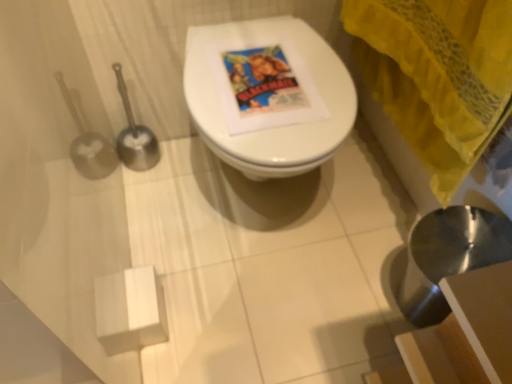
Question: Should I look upward or downward to see metallic silver sink at lower right?

Choices:
 (A) down
 (B) up

Answer: (A)

Question: Does metallic silver sink at lower right have a smaller size compared to yellow fabric curtain at upper right?

Choices:
 (A) no
 (B) yes

Answer: (B)

Question: Is metallic silver sink at lower right not close to yellow fabric curtain at upper right?

Choices:
 (A) yes
 (B) no

Answer: (B)

Question: Considering the relative sizes of metallic silver sink at lower right and yellow fabric curtain at upper right in the image provided, is metallic silver sink at lower right wider than yellow fabric curtain at upper right?

Choices:
 (A) yes
 (B) no

Answer: (A)

Question: Would you say yellow fabric curtain at upper right is part of metallic silver sink at lower right's contents?

Choices:
 (A) no
 (B) yes

Answer: (A)

Question: Does metallic silver sink at lower right touch yellow fabric curtain at upper right?

Choices:
 (A) no
 (B) yes

Answer: (A)

Question: From a real-world perspective, is metallic silver sink at lower right on yellow fabric curtain at upper right?

Choices:
 (A) no
 (B) yes

Answer: (A)

Question: Is metallic silver sink at lower right thinner than white glossy toilet at center?

Choices:
 (A) no
 (B) yes

Answer: (B)

Question: Is metallic silver sink at lower right not near white glossy toilet at center?

Choices:
 (A) no
 (B) yes

Answer: (A)

Question: Could you tell me if metallic silver sink at lower right is facing white glossy toilet at center?

Choices:
 (A) yes
 (B) no

Answer: (B)

Question: Does metallic silver sink at lower right have a larger size compared to white glossy toilet at center?

Choices:
 (A) no
 (B) yes

Answer: (A)

Question: From the image's perspective, would you say metallic silver sink at lower right is shown under white glossy toilet at center?

Choices:
 (A) no
 (B) yes

Answer: (B)

Question: Is metallic silver sink at lower right at the right side of white glossy toilet at center?

Choices:
 (A) yes
 (B) no

Answer: (A)

Question: Is yellow fabric curtain at upper right wider than white glossy toilet at center?

Choices:
 (A) yes
 (B) no

Answer: (B)